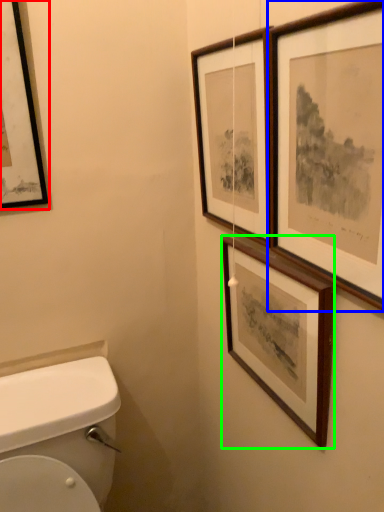
Question: Estimate the real-world distances between objects in this image. Which object is farther from picture frame (highlighted by a red box), picture frame (highlighted by a blue box) or picture frame (highlighted by a green box)?

Choices:
 (A) picture frame
 (B) picture frame

Answer: (A)